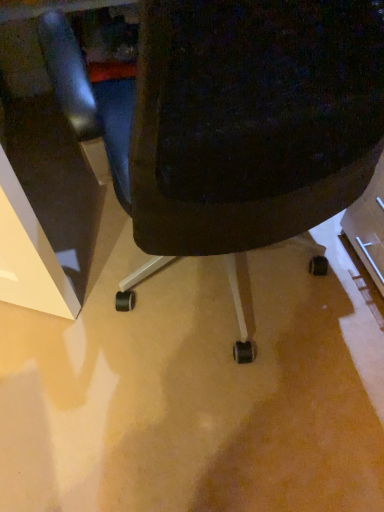
Locate an element on the screen. free location to the left of black fabric chair at center is located at coordinates (61, 316).